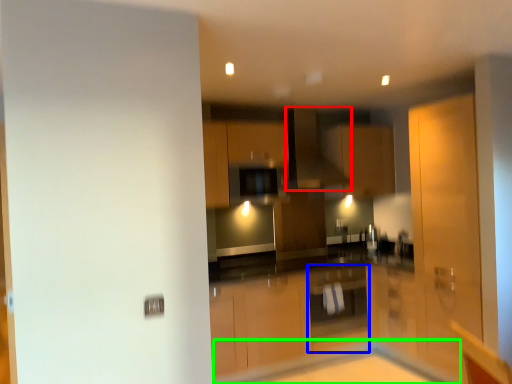
Question: Considering the real-world distances, which object is farthest from exhaust hood (highlighted by a red box)? cabinetry (highlighted by a blue box) or table (highlighted by a green box)?

Choices:
 (A) cabinetry
 (B) table

Answer: (B)